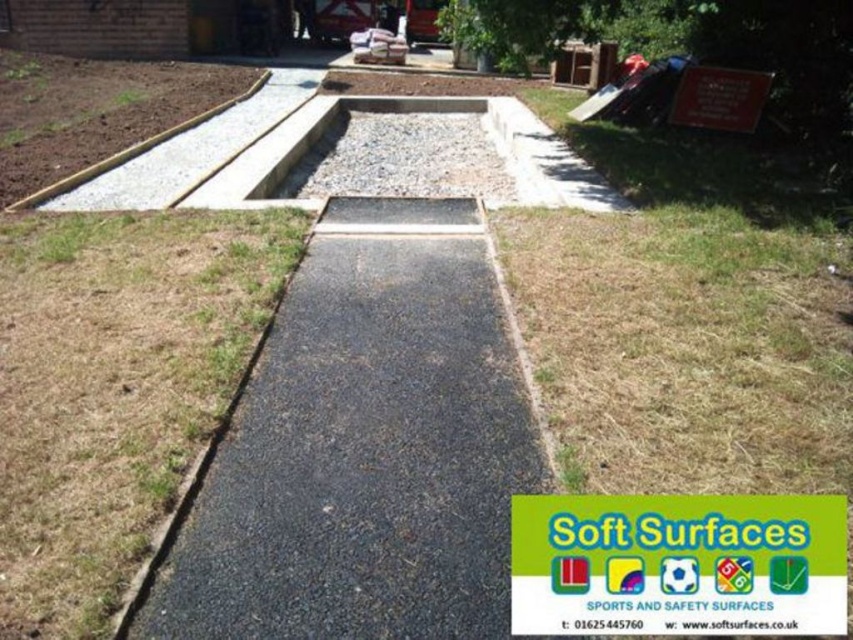
Looking at this image, you are a surveyor standing at the construction site. You need to determine the relative positions of two points marked on the site. The first point is at coordinates point (373, 209) and the second point is at coordinates point (125, 381). From your current position, which point is farther away from you?

Point (373, 209) is behind point (125, 381), so the point farther away from you is point (373, 209).

You are a construction worker standing at the edge of the construction site. You need to walk from your current position to the red sign on the right. Which object, the dry grass at center or the gray gravel at center, will you step on first?

The dry grass at center is in front of gray gravel at center, so you will step on the dry grass at center first before reaching the gray gravel at center.

You are a construction worker standing at the edge of the construction site. You need to place a new safety cone on the black asphalt pavement at center. From your current position, which direction should you move relative to the dry grass at center?

The black asphalt pavement at center is to the right of dry grass at center, so you should move to the right relative to the dry grass at center to place the safety cone.